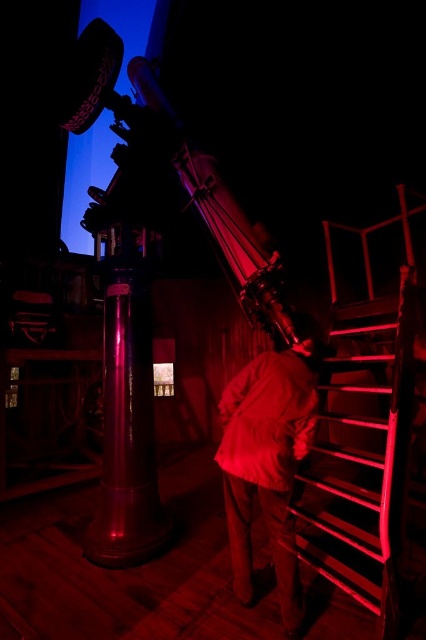
Question: Which point appears closest to the camera in this image?

Choices:
 (A) (250, 582)
 (B) (328, 493)

Answer: (A)

Question: Can you confirm if metallic staircase at right is wider than matte white shirt at center?

Choices:
 (A) no
 (B) yes

Answer: (B)

Question: Among these points, which one is farthest from the camera?

Choices:
 (A) (284, 349)
 (B) (408, 348)

Answer: (A)

Question: Can you confirm if metallic staircase at right is thinner than matte white shirt at center?

Choices:
 (A) yes
 (B) no

Answer: (B)

Question: Which point is farther to the camera?

Choices:
 (A) matte white shirt at center
 (B) metallic staircase at right

Answer: (A)

Question: From the image, what is the correct spatial relationship of metallic staircase at right in relation to matte white shirt at center?

Choices:
 (A) above
 (B) below

Answer: (B)